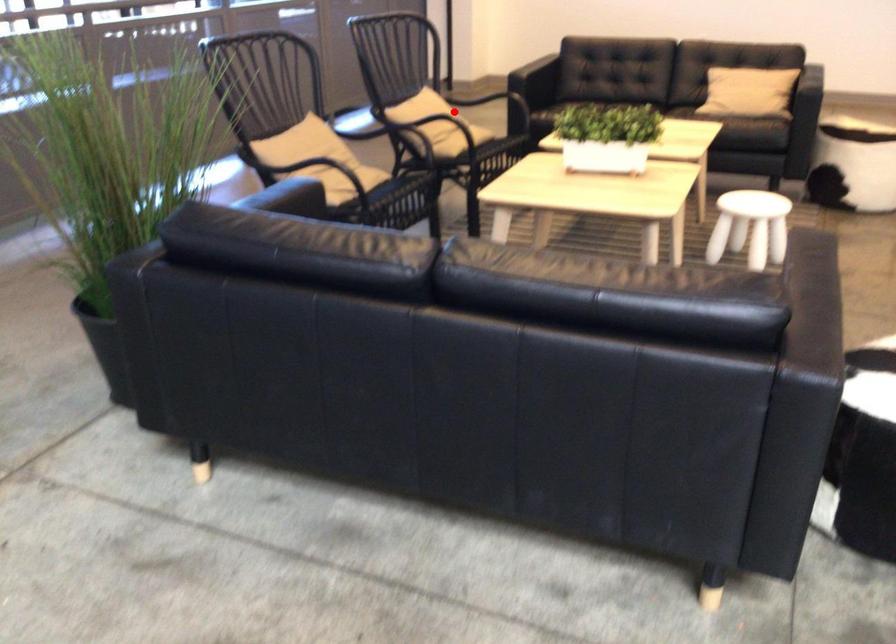
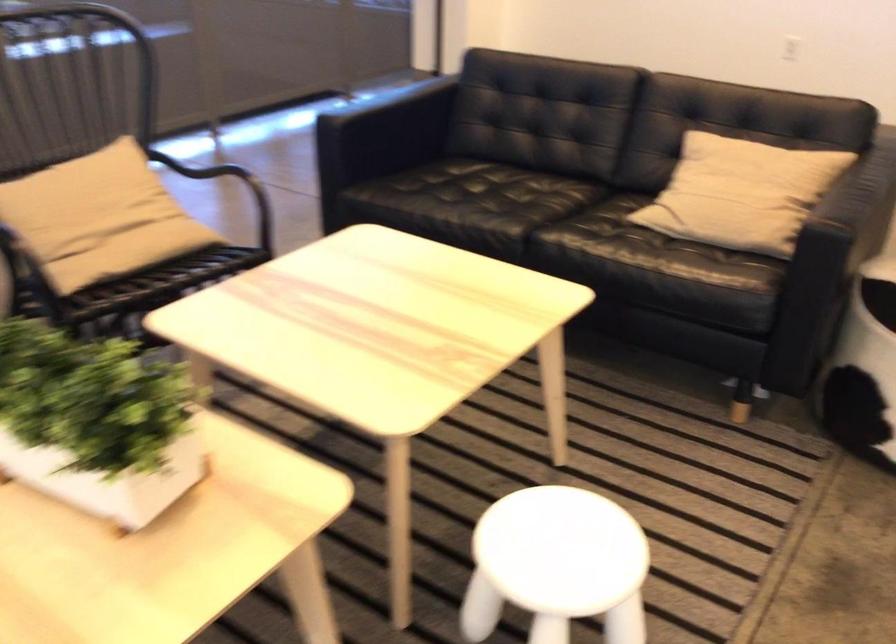
The point at the highlighted location is marked in the first image. Where is the corresponding point in the second image?

(99, 214)